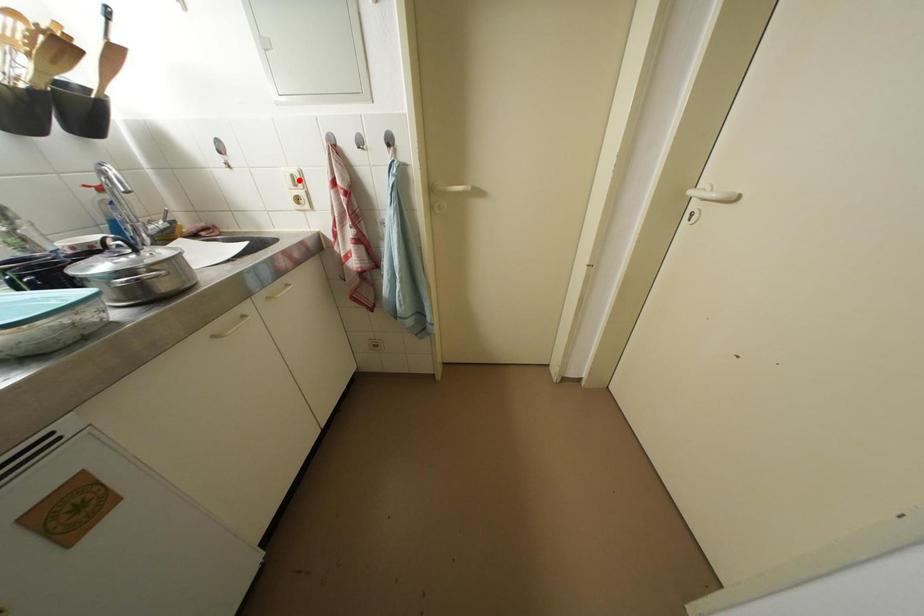
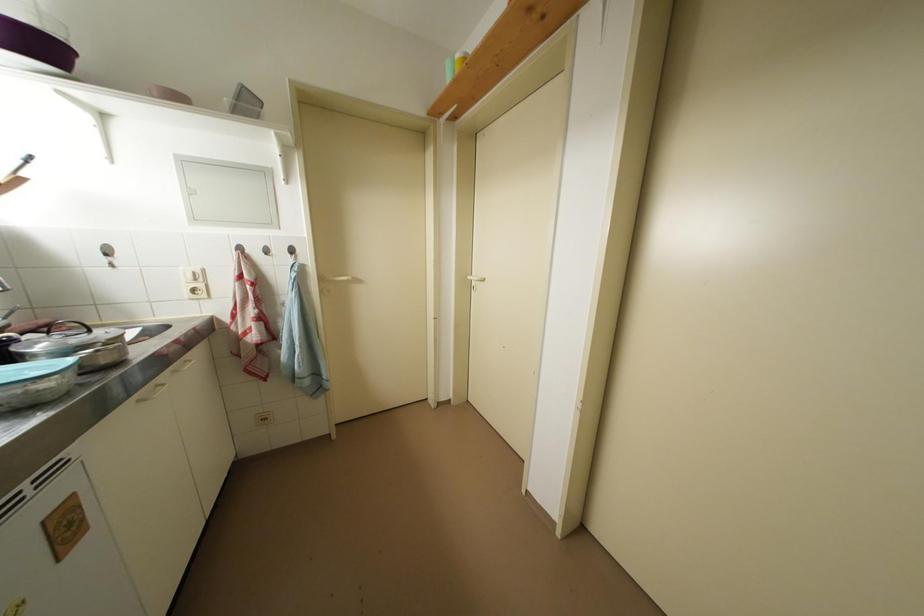
Where in the second image is the point corresponding to the highlighted location from the first image?

(201, 277)